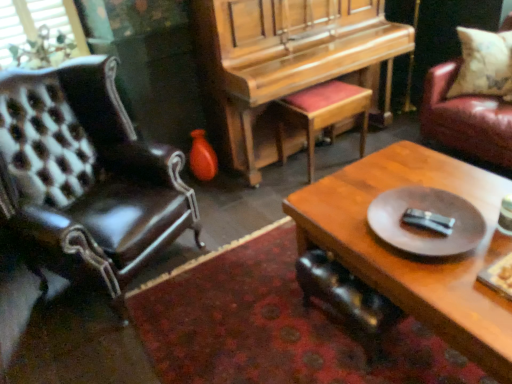
Where is `vacant space to the left of black plastic remote control at center`? vacant space to the left of black plastic remote control at center is located at coordinates (371, 244).